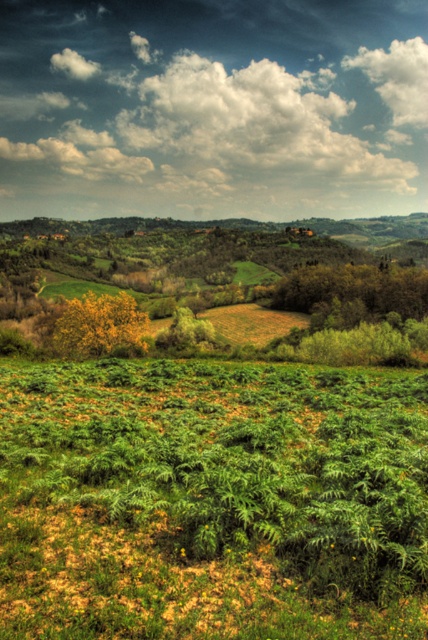
Question: Can you confirm if white fluffy cloud at upper center is smaller than white fluffy cloud at upper right?

Choices:
 (A) yes
 (B) no

Answer: (B)

Question: Which of the following is the farthest from the observer?

Choices:
 (A) white fluffy cloud at upper right
 (B) white fluffy cloud at upper center

Answer: (A)

Question: Is white fluffy cloud at upper center positioned before white fluffy cloud at upper right?

Choices:
 (A) no
 (B) yes

Answer: (B)

Question: Is white fluffy cloud at upper center to the right of white fluffy cloud at upper right from the viewer's perspective?

Choices:
 (A) no
 (B) yes

Answer: (A)

Question: Which point is farther to the camera?

Choices:
 (A) white fluffy cloud at upper center
 (B) white fluffy cloud at upper right

Answer: (B)